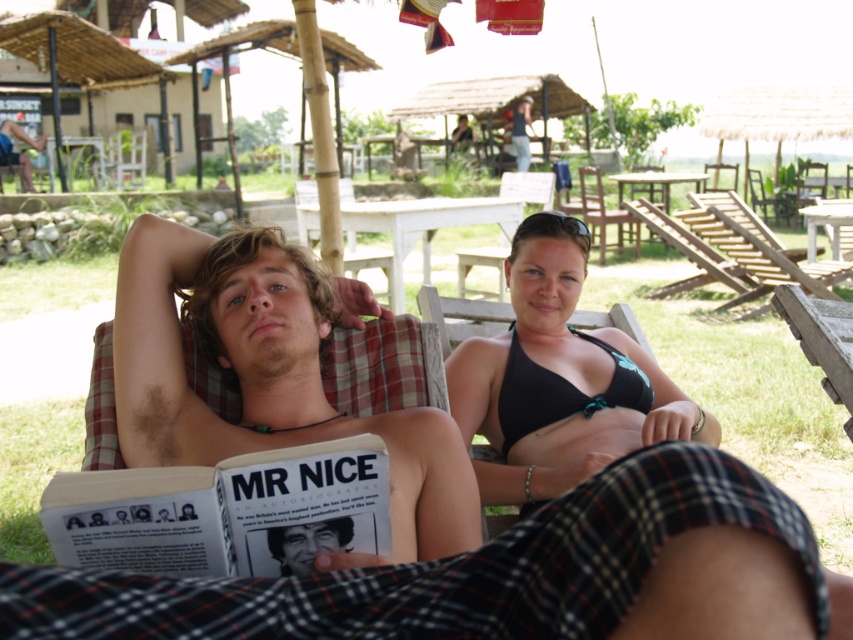
Question: Which of the following is the farthest from the observer?

Choices:
 (A) (630, 218)
 (B) (144, 419)
 (C) (225, 515)
 (D) (585, 250)

Answer: (A)

Question: From the image, what is the correct spatial relationship of wooden chair at center in relation to dark blue shirt at upper center?

Choices:
 (A) right
 (B) left

Answer: (A)

Question: Which point appears farthest from the camera in this image?

Choices:
 (A) (618, 243)
 (B) (47, 493)
 (C) (527, 115)

Answer: (C)

Question: Can you confirm if white paper book at center is positioned above dark blue shirt at upper center?

Choices:
 (A) no
 (B) yes

Answer: (A)

Question: Among these points, which one is nearest to the camera?

Choices:
 (A) (648, 397)
 (B) (561, 394)

Answer: (B)

Question: Observing the image, what is the correct spatial positioning of black matte bikini top at center in reference to wooden chair at center?

Choices:
 (A) above
 (B) below

Answer: (B)